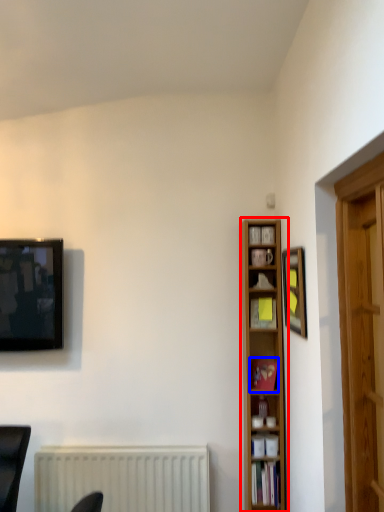
Question: Which of the following is the closest to the observer, bookcase (highlighted by a red box) or book (highlighted by a blue box)?

Choices:
 (A) bookcase
 (B) book

Answer: (A)